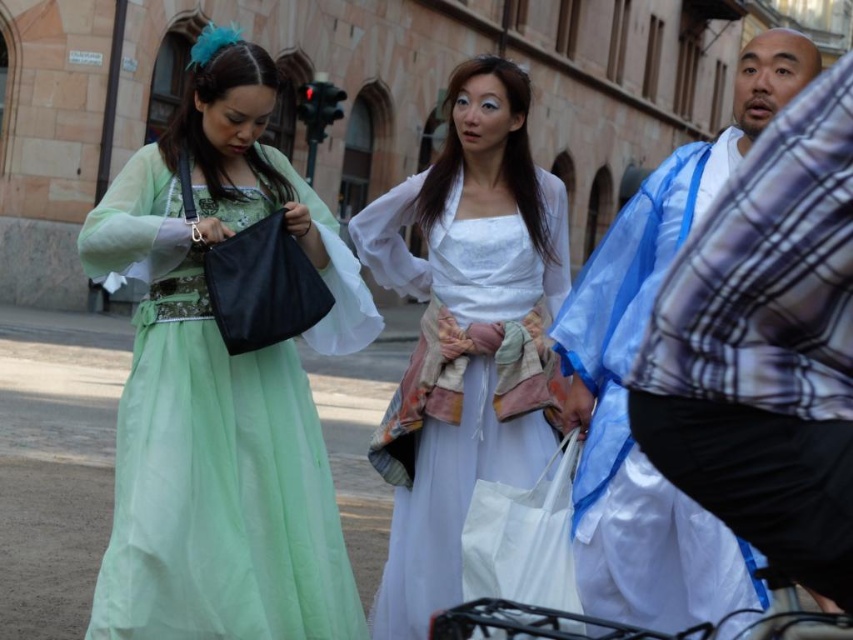
You are a photographer standing at the back of the street scene. You want to take a photo of the white sheer dress at center and the white fabric bag at center. Can you fit both in your camera frame if your camera has a maximum viewing distance of 4 meters?

The distance between the white sheer dress at center and the white fabric bag at center is 3.67 meters, which is less than the camera frame maximum viewing distance of 4 meters. Therefore, both can be captured in the same frame.

You are standing at the origin point of the coordinate system in the image. Which object is located at the coordinates point [219,387]?

The point [219,387] corresponds to the matte green dress at center.